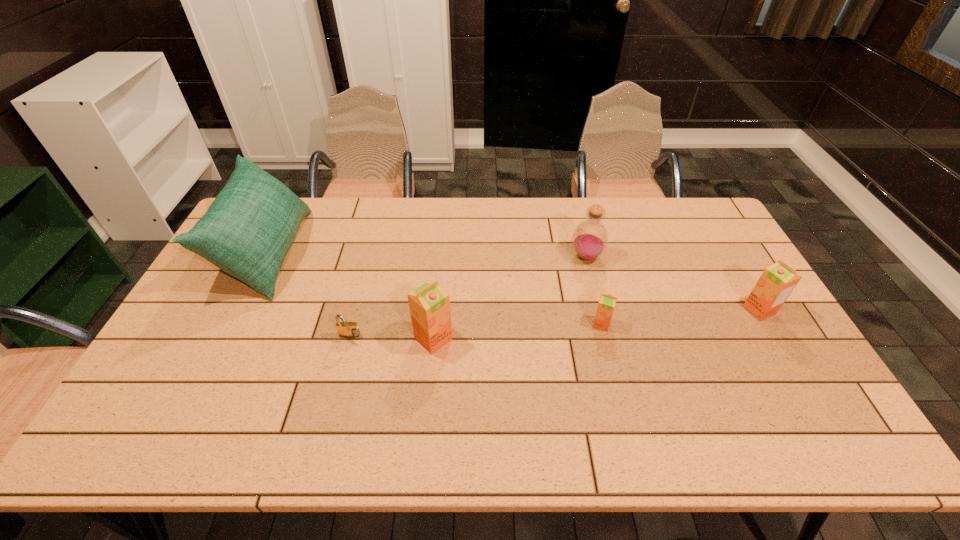
This screenshot has width=960, height=540. What are the coordinates of `the fourth object from right to left` in the screenshot? It's located at (429, 304).

Identify the location of the second shortest object. (607, 302).

Where is `the shortest orange juice`? the shortest orange juice is located at coordinates (607, 302).

Image resolution: width=960 pixels, height=540 pixels. In order to click on the second tallest orange juice in this screenshot , I will do `click(776, 283)`.

Locate an element on the screen. Image resolution: width=960 pixels, height=540 pixels. the rightmost object is located at coordinates (776, 283).

Locate an element on the screen. Image resolution: width=960 pixels, height=540 pixels. bottle is located at coordinates (590, 238).

The width and height of the screenshot is (960, 540). Identify the location of the tallest object. (247, 231).

The height and width of the screenshot is (540, 960). Find the location of `the leftmost object`. the leftmost object is located at coordinates (247, 231).

Locate an element on the screen. This screenshot has height=540, width=960. the shortest object is located at coordinates (345, 329).

You are a GUI agent. You are given a task and a screenshot of the screen. Output one action in this format:
    pyautogui.click(x=<x>, y=<y>)
    Task: Click on the second object from left to right
    The height and width of the screenshot is (540, 960).
    Given the screenshot: What is the action you would take?
    pyautogui.click(x=345, y=329)